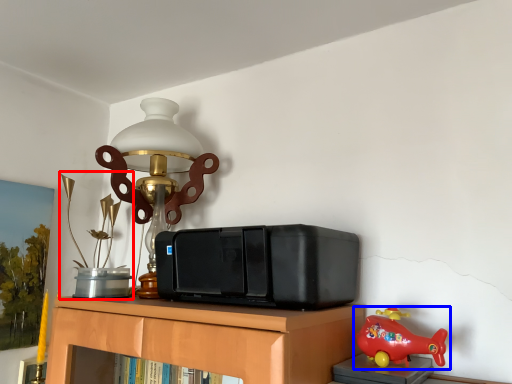
Question: Which of the following is the farthest to the observer, toy (highlighted by a red box) or toy (highlighted by a blue box)?

Choices:
 (A) toy
 (B) toy

Answer: (A)